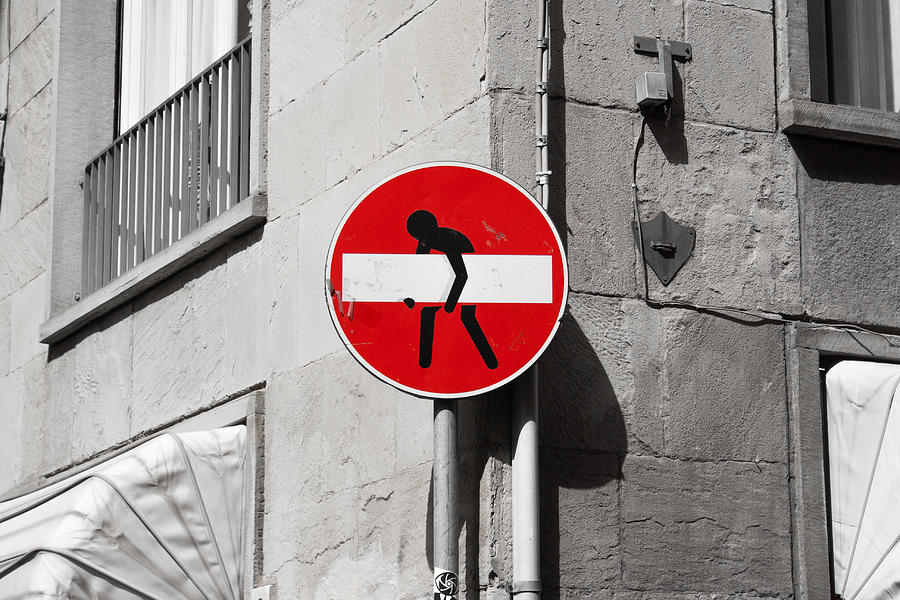
Locate an element on the screen. window is located at coordinates 189,67.